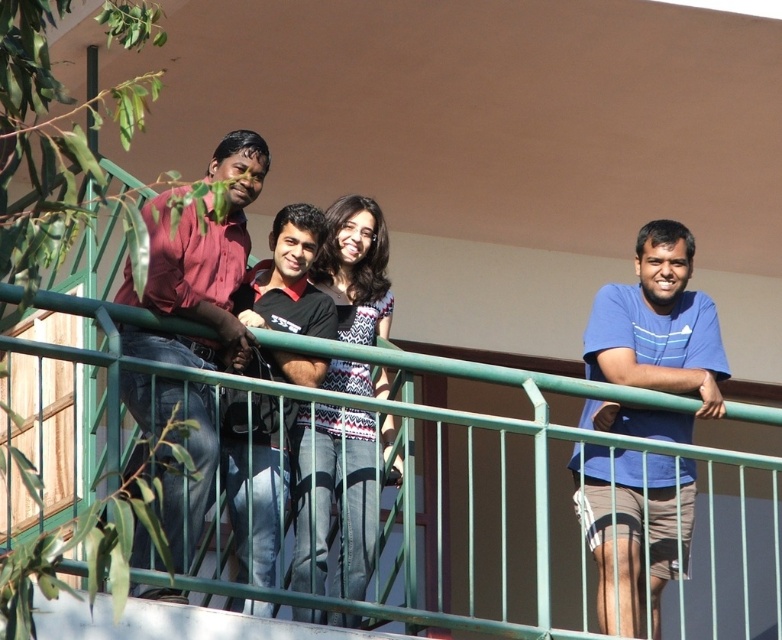
You are standing on the balcony and want to hand a drink to both the blue cotton shirt at right and the black cotton shirt at center. Which person should you approach first to ensure you can reach them without moving?

You should approach the blue cotton shirt at right first because they are closer to you than the black cotton shirt at center, so you can reach them without needing to move further.

You are standing on the balcony and want to reach the point marked at coordinates (694, 573). Considering the railing is 3 feet wide, can you safely step over it to reach that point?

The point at coordinates (694, 573) is 241.58 feet away from the viewer, which is too far to safely step over the 3 feet wide railing. You should not attempt to reach it this way.